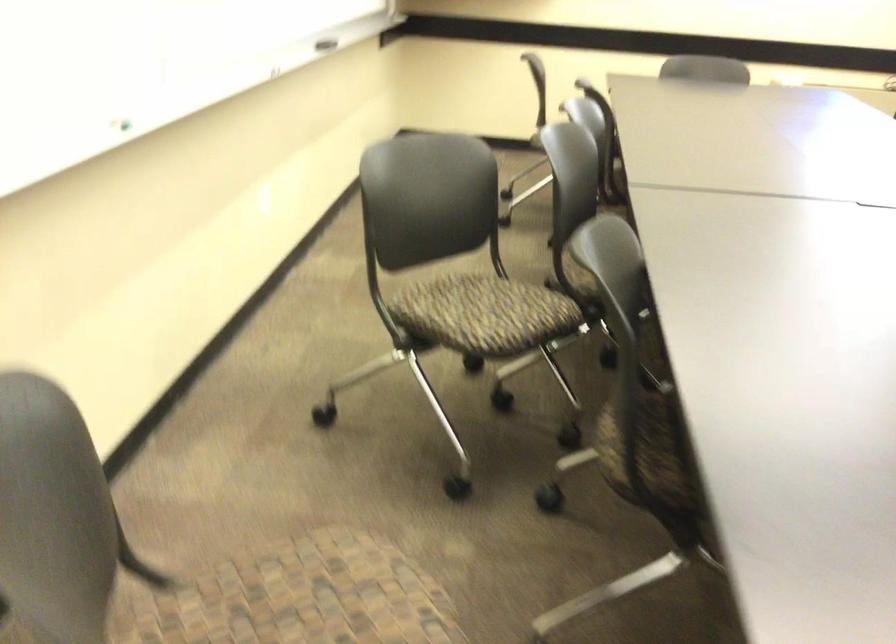
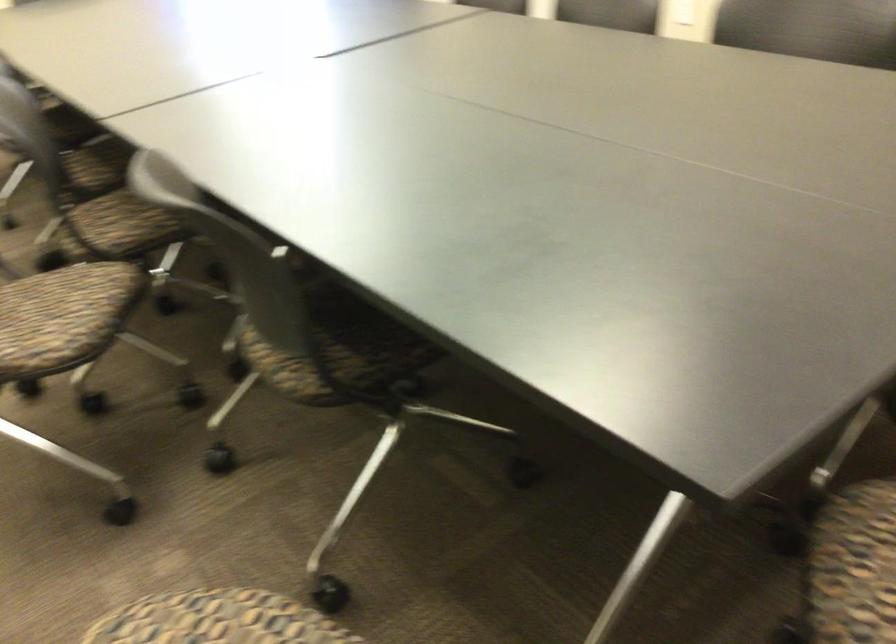
In the second image, find the point that corresponds to [494,305] in the first image.

(53, 307)